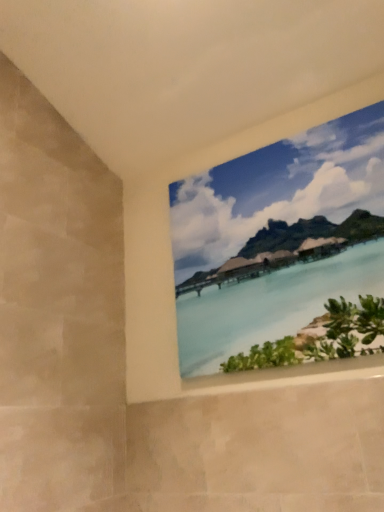
What is the approximate width of matte plastic picture frame at upper right?

It is 2.74 inches.

Find the location of a particular element. matte plastic picture frame at upper right is located at coordinates (278, 192).

The width and height of the screenshot is (384, 512). Describe the element at coordinates (278, 192) in the screenshot. I see `matte plastic picture frame at upper right` at that location.

I want to click on matte plastic picture frame at upper right, so click(x=278, y=192).